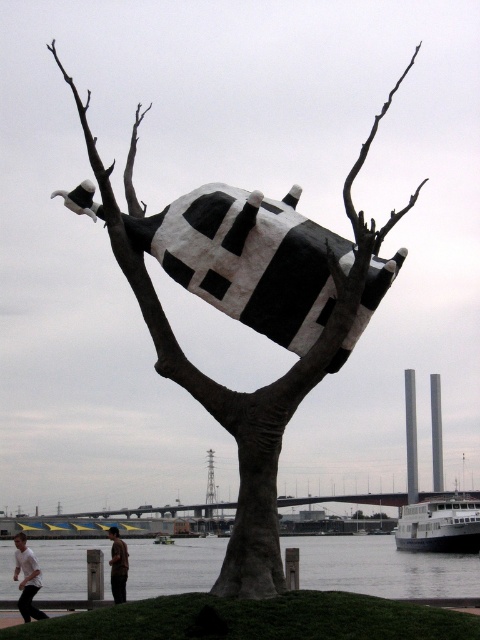
What are the coordinates of the black and white painted sculpture at center?

The black and white painted sculpture at center is located at coordinates point (248, 259).

You are an art critic analyzing the sculpture. You notice two parts of the sculpture labeled as the black and white painted sculpture at center and the black matte sculpture at center. Which one is positioned to the left?

The black and white painted sculpture at center is positioned to the left of the black matte sculpture at center.

You are an art curator planning to display both the black and white painted sculpture at center and the black matte sculpture at center in a gallery. If you want to arrange them so that the taller sculpture is placed at the back to avoid blocking the view of the shorter one, which sculpture should be placed at the back?

The black matte sculpture at center should be placed at the back because it is taller than the black and white painted sculpture at center, allowing the shorter sculpture to be visible in front.